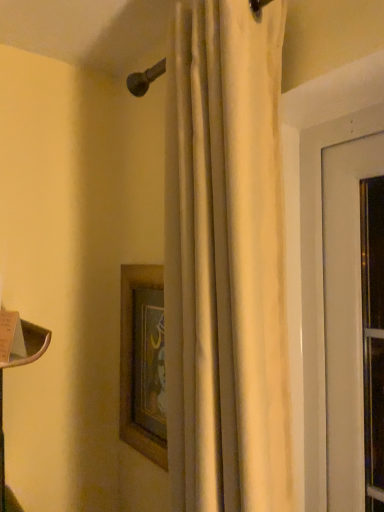
You are a GUI agent. You are given a task and a screenshot of the screen. Output one action in this format:
    pyautogui.click(x=<x>, y=<y>)
    Task: Click on the white matte curtain at center
    
    Given the screenshot: What is the action you would take?
    pyautogui.click(x=225, y=261)

What do you see at coordinates (225, 261) in the screenshot? I see `white matte curtain at center` at bounding box center [225, 261].

What do you see at coordinates (143, 362) in the screenshot?
I see `wooden framed picture at center` at bounding box center [143, 362].

Identify the location of wooden framed picture at center. The width and height of the screenshot is (384, 512). (143, 362).

Where is `white matte curtain at center`? white matte curtain at center is located at coordinates (225, 261).

From the picture: Considering the positions of objects wooden framed picture at center and white matte curtain at center in the image provided, who is more to the left, wooden framed picture at center or white matte curtain at center?

From the viewer's perspective, wooden framed picture at center appears more on the left side.

Which object is further away from the camera, wooden framed picture at center or white matte curtain at center?

wooden framed picture at center is further away from the camera.

Is point (157, 284) closer to viewer compared to point (267, 35)?

That is False.

Consider the image. From the image's perspective, is wooden framed picture at center over white matte curtain at center?

No, from the image's perspective, wooden framed picture at center is not over white matte curtain at center.

From a real-world perspective, which is physically below, wooden framed picture at center or white matte curtain at center?

From a 3D spatial view, wooden framed picture at center is below.

Does wooden framed picture at center have a lesser width compared to white matte curtain at center?

Yes.

Which of these two, wooden framed picture at center or white matte curtain at center, stands taller?

Standing taller between the two is white matte curtain at center.

Which of these two, wooden framed picture at center or white matte curtain at center, is bigger?

white matte curtain at center is bigger.

Is wooden framed picture at center completely or partially outside of white matte curtain at center?

Yes, wooden framed picture at center is outside of white matte curtain at center.

Are wooden framed picture at center and white matte curtain at center far apart?

No, wooden framed picture at center is not far from white matte curtain at center.

Could you tell me if wooden framed picture at center is turned towards white matte curtain at center?

No, wooden framed picture at center does not turn towards white matte curtain at center.

How many degrees apart are the facing directions of wooden framed picture at center and white matte curtain at center?

They differ by 1.31 degrees in their facing directions.

Locate an element on the screen. The height and width of the screenshot is (512, 384). curtain above the wooden framed picture at center (from the image's perspective) is located at coordinates (225, 261).

Which object is positioned more to the left, white matte curtain at center or wooden framed picture at center?

From the viewer's perspective, wooden framed picture at center appears more on the left side.

Is white matte curtain at center in front of or behind wooden framed picture at center in the image?

white matte curtain at center is in front of wooden framed picture at center.

Is point (220, 442) closer to viewer compared to point (120, 416)?

Yes, it is in front of point (120, 416).

From the image's perspective, which one is positioned higher, white matte curtain at center or wooden framed picture at center?

white matte curtain at center is shown above in the image.

From a real-world perspective, which object stands above the other?

white matte curtain at center.

Considering the relative sizes of white matte curtain at center and wooden framed picture at center in the image provided, is white matte curtain at center wider than wooden framed picture at center?

Correct, the width of white matte curtain at center exceeds that of wooden framed picture at center.

Between white matte curtain at center and wooden framed picture at center, which one has less height?

Standing shorter between the two is wooden framed picture at center.

Considering the sizes of white matte curtain at center and wooden framed picture at center in the image, is white matte curtain at center bigger or smaller than wooden framed picture at center?

In the image, white matte curtain at center appears to be larger than wooden framed picture at center.

Is white matte curtain at center not inside wooden framed picture at center?

Yes, white matte curtain at center is not within wooden framed picture at center.

Is white matte curtain at center directly adjacent to wooden framed picture at center?

No, white matte curtain at center is not next to wooden framed picture at center.

Is white matte curtain at center looking in the opposite direction of wooden framed picture at center?

No, white matte curtain at center is not facing away from wooden framed picture at center.

At what (x,y) coordinates should I click in order to perform the action: click on curtain above the wooden framed picture at center (from a real-world perspective). Please return your answer as a coordinate pair (x, y). This screenshot has width=384, height=512. Looking at the image, I should click on (225, 261).

At what (x,y) coordinates should I click in order to perform the action: click on curtain located above the wooden framed picture at center (from a real-world perspective). Please return your answer as a coordinate pair (x, y). Image resolution: width=384 pixels, height=512 pixels. Looking at the image, I should click on (225, 261).

At what (x,y) coordinates should I click in order to perform the action: click on picture frame directly beneath the white matte curtain at center (from a real-world perspective). Please return your answer as a coordinate pair (x, y). The width and height of the screenshot is (384, 512). Looking at the image, I should click on (143, 362).